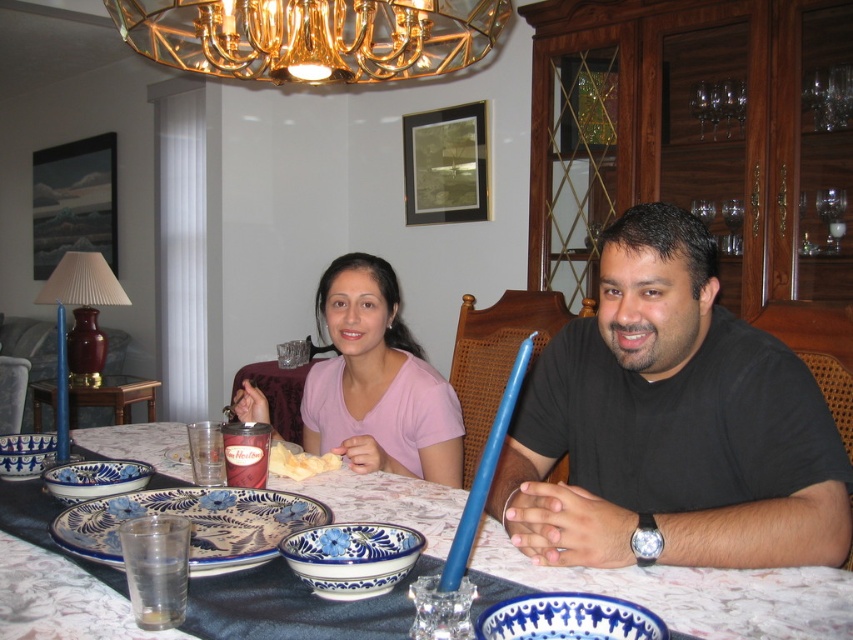
Does blue ceramic bowl at center have a lesser width compared to white crumbly cake at center?

Incorrect, blue ceramic bowl at center's width is not less than white crumbly cake at center's.

In the scene shown: Which of these two, blue ceramic bowl at center or white crumbly cake at center, stands shorter?

white crumbly cake at center is shorter.

Locate an element on the screen. blue ceramic bowl at center is located at coordinates (277, 394).

Who is taller, gold metallic chandelier at upper center or white crumbly cake at center?

With more height is gold metallic chandelier at upper center.

Does gold metallic chandelier at upper center come behind white crumbly cake at center?

No, gold metallic chandelier at upper center is closer to the viewer.

Which is behind, point (173, 58) or point (332, 468)?

The point (173, 58) is behind.

Find the location of a particular element. Image resolution: width=853 pixels, height=640 pixels. gold metallic chandelier at upper center is located at coordinates (311, 36).

Is blue painted earthenware platter at center to the left of blue ceramic plate at lower center from the viewer's perspective?

Correct, you'll find blue painted earthenware platter at center to the left of blue ceramic plate at lower center.

Between point (260, 531) and point (619, 620), which one is positioned in front?

Positioned in front is point (619, 620).

The width and height of the screenshot is (853, 640). What are the coordinates of `blue painted earthenware platter at center` in the screenshot? It's located at (193, 524).